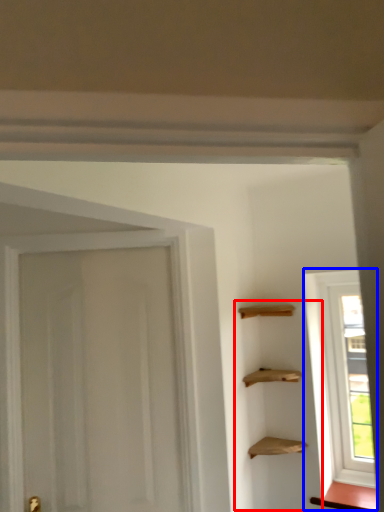
Question: Which object appears closest to the camera in this image, cabinetry (highlighted by a red box) or window (highlighted by a blue box)?

Choices:
 (A) cabinetry
 (B) window

Answer: (A)